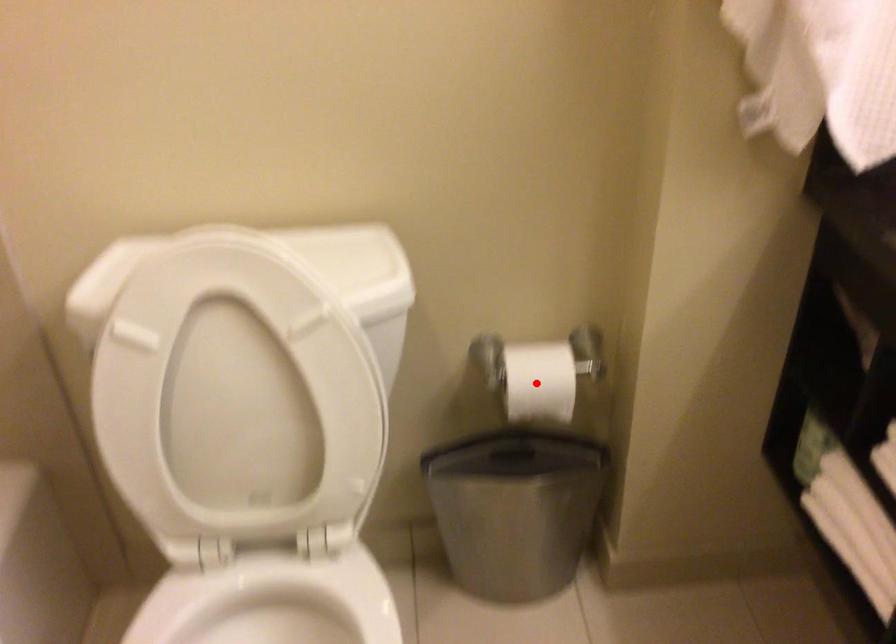
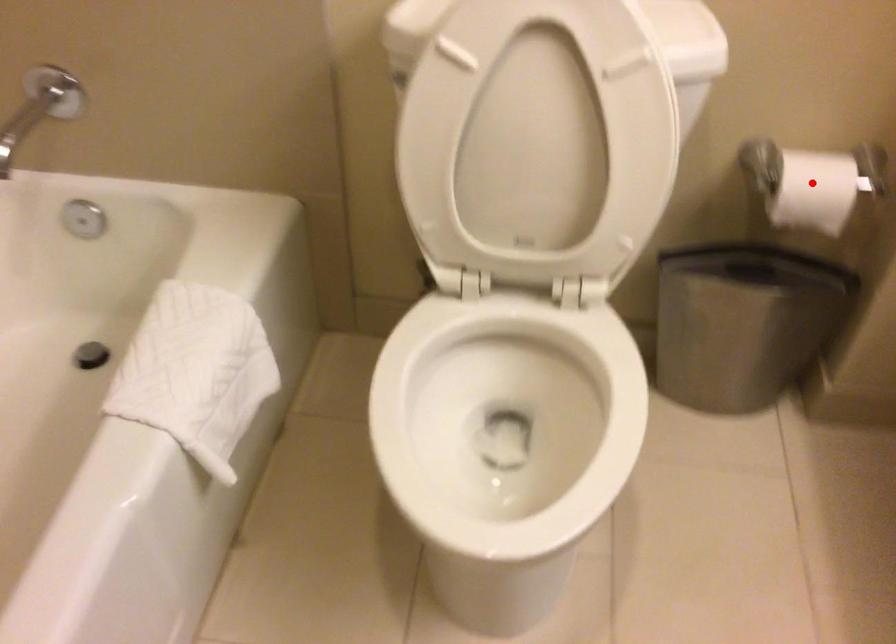
I am providing you with two images of the same scene from different viewpoints. A red point is marked on the first image and another point is marked on the second image. Does the point marked in image1 correspond to the same location as the one in image2?

Yes